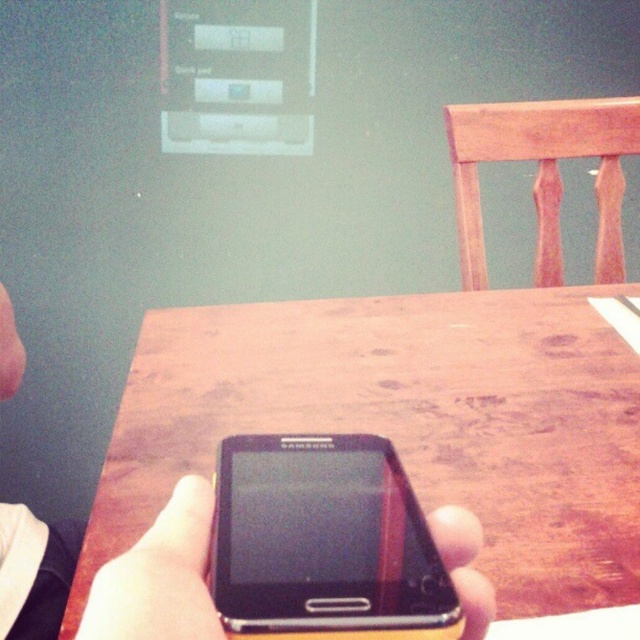
Question: Does black matte phone at center appear on the left side of skinny white skin at lower left?

Choices:
 (A) yes
 (B) no

Answer: (B)

Question: Is wooden table at center bigger than skinny white skin at lower left?

Choices:
 (A) yes
 (B) no

Answer: (A)

Question: Which object is positioned farthest from the wooden table at center?

Choices:
 (A) black matte phone at center
 (B) skinny white skin at lower left

Answer: (A)

Question: Estimate the real-world distances between objects in this image. Which object is closer to the skinny white skin at lower left?

Choices:
 (A) black matte phone at center
 (B) wooden table at center

Answer: (B)

Question: Is wooden table at center bigger than skinny white skin at lower left?

Choices:
 (A) no
 (B) yes

Answer: (B)

Question: Which object appears closest to the camera in this image?

Choices:
 (A) wooden table at center
 (B) black matte phone at center

Answer: (B)